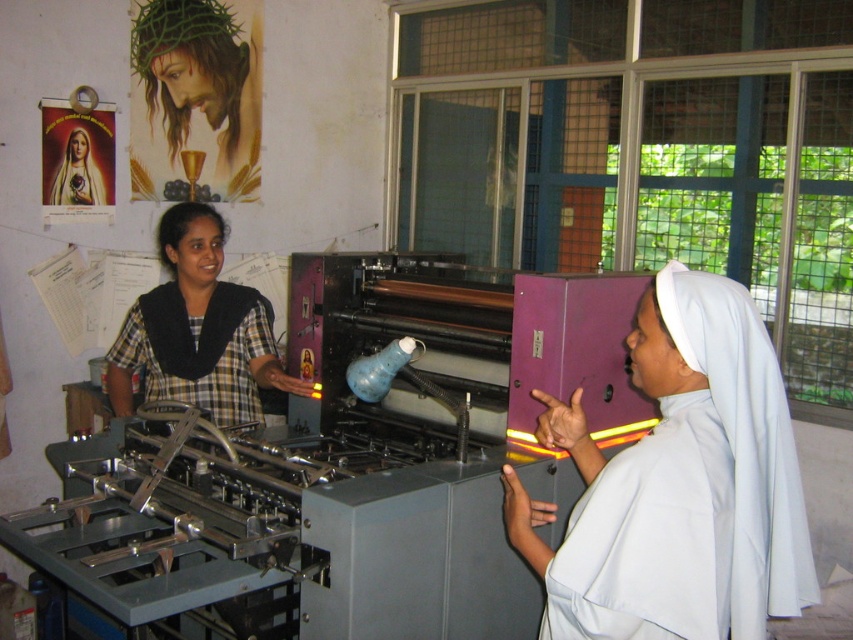
You are standing in the workspace and want to move from point (149,90) to point (143,387). Which direction should you move in terms of depth?

You should move away from the viewer because point (149,90) is further to the viewer than point (143,387).

Based on the coordinates provided, what object is located at point (x=679, y=484) in the scene?

The point at (x=679, y=484) indicates the white matte nun s habit at center.